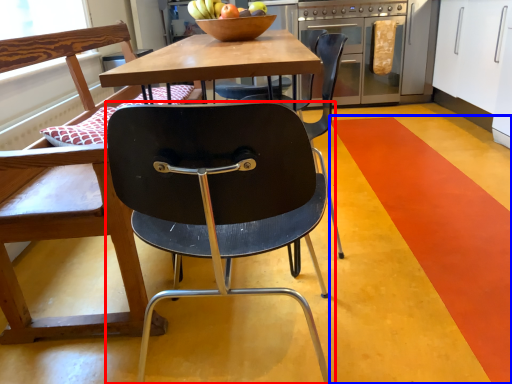
Question: Among these objects, which one is farthest to the camera, chair (highlighted by a red box) or stripe (highlighted by a blue box)?

Choices:
 (A) chair
 (B) stripe

Answer: (B)